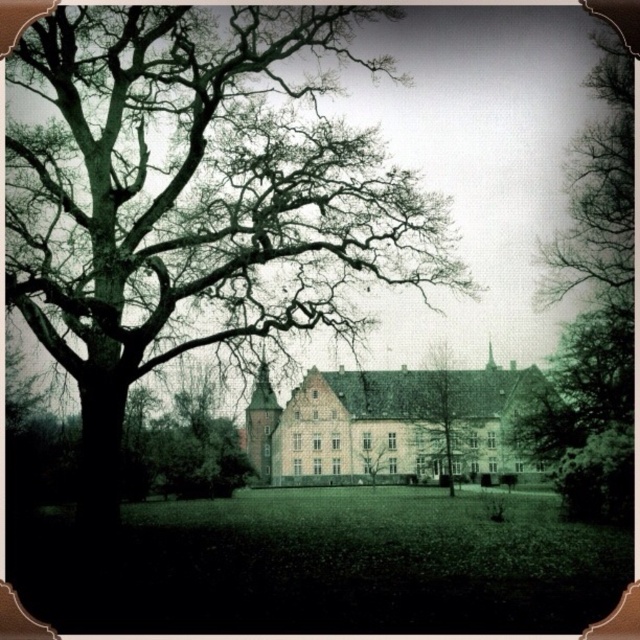
Question: From the image, what is the correct spatial relationship of smooth bark tree at center in relation to green leafy tree at center?

Choices:
 (A) right
 (B) left

Answer: (A)

Question: Is green leafy tree at right closer to the viewer compared to green leafy tree at center?

Choices:
 (A) yes
 (B) no

Answer: (A)

Question: Which of the following is the closest to the observer?

Choices:
 (A) (278, 188)
 (B) (426, 378)

Answer: (A)

Question: Is smooth bark tree at center bigger than green leafy tree at center?

Choices:
 (A) yes
 (B) no

Answer: (A)

Question: Among these points, which one is farthest from the camera?

Choices:
 (A) (248, 410)
 (B) (294, 180)
 (C) (374, 476)

Answer: (A)

Question: Which of the following is the farthest from the observer?

Choices:
 (A) white smooth building at center
 (B) dark green textured tree at left
 (C) green leafy tree at right

Answer: (C)